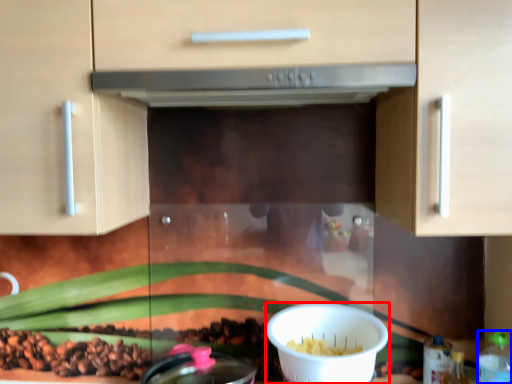
Question: Which object appears farthest to the camera in this image, bowl (highlighted by a red box) or bottle (highlighted by a blue box)?

Choices:
 (A) bowl
 (B) bottle

Answer: (A)